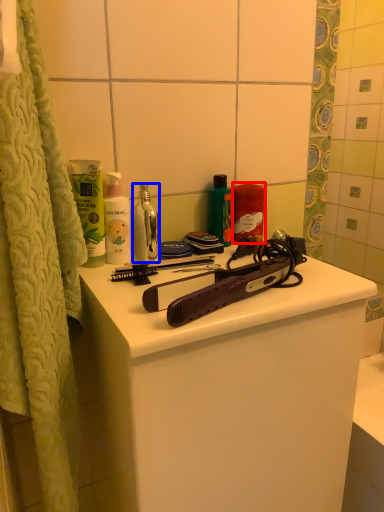
Question: Which point is further to the camera, cleaning product (highlighted by a red box) or mouthwash (highlighted by a blue box)?

Choices:
 (A) cleaning product
 (B) mouthwash

Answer: (A)